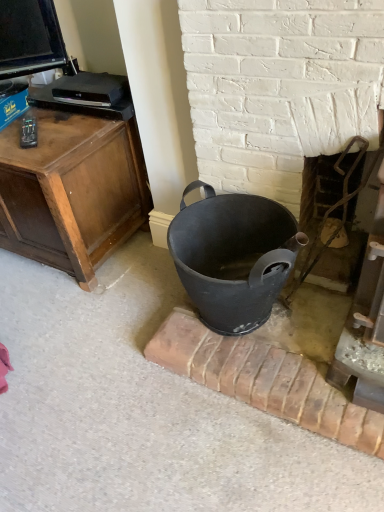
What do you see at coordinates (334, 209) in the screenshot? The width and height of the screenshot is (384, 512). I see `rustic metal fireplace at right, acting as the first fireplace starting from the right` at bounding box center [334, 209].

Locate an element on the screen. The image size is (384, 512). matte black bucket at center, placed as the 2th fireplace when sorted from right to left is located at coordinates (280, 88).

From the image's perspective, which object appears higher, rustic metal fireplace at right, acting as the first fireplace starting from the right, or matte black bucket at center, the first fireplace when ordered from left to right?

From the image's view, matte black bucket at center, the first fireplace when ordered from left to right, is above.

Identify the location of fireplace that is on the left side of rustic metal fireplace at right, acting as the first fireplace starting from the right. Image resolution: width=384 pixels, height=512 pixels. (280, 88).

Considering the sizes of objects rustic metal fireplace at right, positioned as the second fireplace in left-to-right order, and matte black bucket at center, the first fireplace when ordered from left to right, in the image provided, who is wider, rustic metal fireplace at right, positioned as the second fireplace in left-to-right order, or matte black bucket at center, the first fireplace when ordered from left to right,?

rustic metal fireplace at right, positioned as the second fireplace in left-to-right order, is wider.

From a real-world perspective, which is physically below, rustic metal fireplace at right, acting as the first fireplace starting from the right, or matte black bucket at center, the first fireplace when ordered from left to right?

In real-world perspective, rustic metal fireplace at right, acting as the first fireplace starting from the right, is lower.

Is matte black trash can at center with matte black bucket at center, the first fireplace when ordered from left to right?

matte black trash can at center and matte black bucket at center, the first fireplace when ordered from left to right, are clearly separated.

Could you tell me if matte black trash can at center is turned towards matte black bucket at center, placed as the 2th fireplace when sorted from right to left?

No, matte black trash can at center is not aimed at matte black bucket at center, placed as the 2th fireplace when sorted from right to left.

From a real-world perspective, does matte black trash can at center sit lower than matte black bucket at center, placed as the 2th fireplace when sorted from right to left?

Yes, from a real-world perspective, matte black trash can at center is below matte black bucket at center, placed as the 2th fireplace when sorted from right to left.

Is matte black bucket at center, placed as the 2th fireplace when sorted from right to left, to the left of matte black trash can at center from the viewer's perspective?

No, matte black bucket at center, placed as the 2th fireplace when sorted from right to left, is not to the left of matte black trash can at center.

Can you confirm if matte black bucket at center, placed as the 2th fireplace when sorted from right to left, is shorter than matte black trash can at center?

No.

Find the location of a particular element. This screenshot has width=384, height=512. trash bin/can behind the matte black bucket at center, the first fireplace when ordered from left to right is located at coordinates (233, 256).

Is matte black bucket at center, the first fireplace when ordered from left to right, inside the boundaries of matte black trash can at center, or outside?

matte black bucket at center, the first fireplace when ordered from left to right, is not enclosed by matte black trash can at center.

Would you say matte black bucket at center, placed as the 2th fireplace when sorted from right to left, is inside or outside rustic metal fireplace at right, acting as the first fireplace starting from the right?

matte black bucket at center, placed as the 2th fireplace when sorted from right to left, is located beyond the bounds of rustic metal fireplace at right, acting as the first fireplace starting from the right.

Is matte black bucket at center, placed as the 2th fireplace when sorted from right to left, taller than rustic metal fireplace at right, acting as the first fireplace starting from the right?

Yes.

In the scene shown: From a real-world perspective, is matte black bucket at center, placed as the 2th fireplace when sorted from right to left, beneath rustic metal fireplace at right, positioned as the second fireplace in left-to-right order?

No.

Is point (299, 156) farther from camera compared to point (332, 239)?

No, (299, 156) is in front of (332, 239).

Considering their positions, is matte black trash can at center located in front of or behind rustic metal fireplace at right, acting as the first fireplace starting from the right?

Clearly, matte black trash can at center is in front of rustic metal fireplace at right, acting as the first fireplace starting from the right.

Would you consider matte black trash can at center to be distant from rustic metal fireplace at right, positioned as the second fireplace in left-to-right order?

No.

Considering the relative positions of matte black trash can at center and rustic metal fireplace at right, positioned as the second fireplace in left-to-right order, in the image provided, is matte black trash can at center to the left of rustic metal fireplace at right, positioned as the second fireplace in left-to-right order, from the viewer's perspective?

Indeed, matte black trash can at center is positioned on the left side of rustic metal fireplace at right, positioned as the second fireplace in left-to-right order.

Is point (211, 205) closer or farther from the camera than point (298, 278)?

Point (211, 205) is positioned closer to the camera compared to point (298, 278).

From the image's perspective, is rustic metal fireplace at right, acting as the first fireplace starting from the right, above or below matte black trash can at center?

Based on their image positions, rustic metal fireplace at right, acting as the first fireplace starting from the right, is located above matte black trash can at center.

Between rustic metal fireplace at right, positioned as the second fireplace in left-to-right order, and matte black trash can at center, which one has less height?

matte black trash can at center is shorter.

Is rustic metal fireplace at right, positioned as the second fireplace in left-to-right order, in front of or behind matte black trash can at center in the image?

Visually, rustic metal fireplace at right, positioned as the second fireplace in left-to-right order, is located behind matte black trash can at center.

Between rustic metal fireplace at right, positioned as the second fireplace in left-to-right order, and matte black trash can at center, which one has larger width?

matte black trash can at center.

I want to click on fireplace behind the matte black bucket at center, placed as the 2th fireplace when sorted from right to left, so click(334, 209).

This screenshot has height=512, width=384. Identify the location of trash bin/can beneath the matte black bucket at center, placed as the 2th fireplace when sorted from right to left (from a real-world perspective). (233, 256).

Based on their spatial positions, is rustic metal fireplace at right, positioned as the second fireplace in left-to-right order, or matte black bucket at center, the first fireplace when ordered from left to right, closer to matte black trash can at center?

Among the two, matte black bucket at center, the first fireplace when ordered from left to right, is located nearer to matte black trash can at center.

Estimate the real-world distances between objects in this image. Which object is further from rustic metal fireplace at right, acting as the first fireplace starting from the right, matte black bucket at center, the first fireplace when ordered from left to right, or matte black trash can at center?

matte black trash can at center.

From the image, which object appears to be farther from matte black bucket at center, placed as the 2th fireplace when sorted from right to left, rustic metal fireplace at right, acting as the first fireplace starting from the right, or matte black trash can at center?

matte black trash can at center lies further to matte black bucket at center, placed as the 2th fireplace when sorted from right to left, than the other object.

Consider the image. Looking at the image, which one is located further to matte black bucket at center, the first fireplace when ordered from left to right, matte black trash can at center or rustic metal fireplace at right, acting as the first fireplace starting from the right?

matte black trash can at center is positioned further to the anchor matte black bucket at center, the first fireplace when ordered from left to right.

Estimate the real-world distances between objects in this image. Which object is closer to matte black trash can at center, matte black bucket at center, placed as the 2th fireplace when sorted from right to left, or rustic metal fireplace at right, acting as the first fireplace starting from the right?

Based on the image, matte black bucket at center, placed as the 2th fireplace when sorted from right to left, appears to be nearer to matte black trash can at center.

Based on their spatial positions, is matte black trash can at center or matte black bucket at center, the first fireplace when ordered from left to right, closer to rustic metal fireplace at right, acting as the first fireplace starting from the right?

matte black bucket at center, the first fireplace when ordered from left to right, is closer to rustic metal fireplace at right, acting as the first fireplace starting from the right.

Where is `fireplace between matte black bucket at center, the first fireplace when ordered from left to right, and matte black trash can at center from top to bottom`? The width and height of the screenshot is (384, 512). fireplace between matte black bucket at center, the first fireplace when ordered from left to right, and matte black trash can at center from top to bottom is located at coordinates (334, 209).